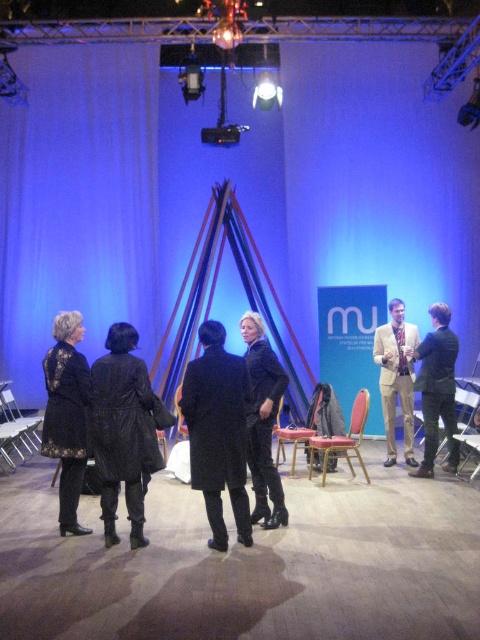
You are an event planner standing on the stage looking down at the black leather shoes at lower center and the black wool coat at center. Which object is positioned lower in the image?

The black leather shoes at lower center is positioned below the black wool coat at center, so it is lower in the image.